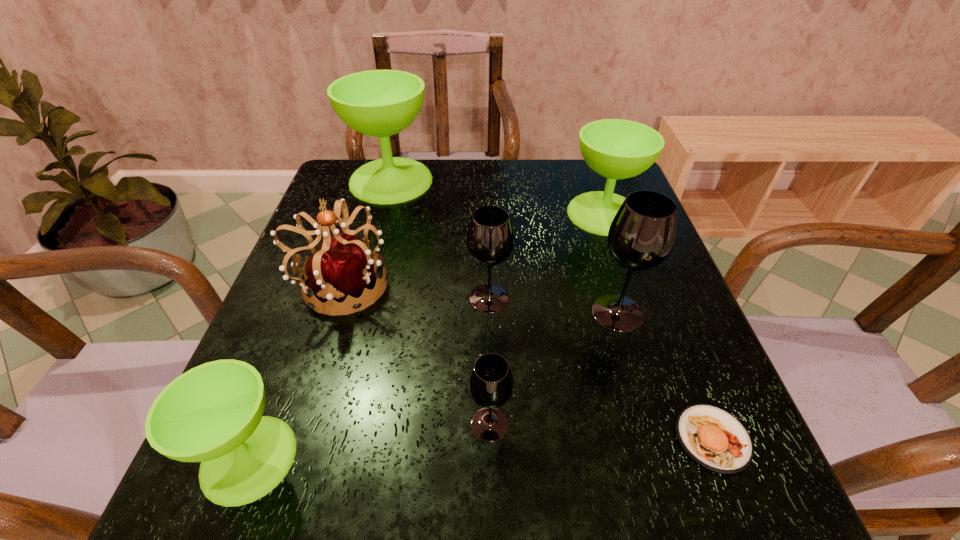
Image resolution: width=960 pixels, height=540 pixels. I want to click on free spot between the nearest green wineglass and the red tiara, so click(x=295, y=372).

Where is `free area in between the nearest green wineglass and the rightmost green wineglass`? free area in between the nearest green wineglass and the rightmost green wineglass is located at coordinates (426, 336).

Locate an element on the screen. The image size is (960, 540). free space between the biggest green wineglass and the rightmost green wineglass is located at coordinates (497, 197).

Image resolution: width=960 pixels, height=540 pixels. I want to click on vacant space in between the second smallest gray wineglass and the biggest gray wineglass, so click(x=553, y=305).

Find the location of a particular element. free spot between the rightmost green wineglass and the smallest green wineglass is located at coordinates [426, 336].

You are a GUI agent. You are given a task and a screenshot of the screen. Output one action in this format:
    pyautogui.click(x=<x>, y=<y>)
    Task: Click on the free space between the second biggest gray wineglass and the rightmost gray wineglass
    The height and width of the screenshot is (540, 960).
    Given the screenshot: What is the action you would take?
    pyautogui.click(x=553, y=305)

Identify which object is located as the third nearest to the biggest green wineglass. Please provide its 2D coordinates. Your answer should be formatted as a tuple, i.e. [(x, y)], where the tuple contains the x and y coordinates of a point satisfying the conditions above.

[(617, 149)]

What are the coordinates of `object that is the closest to the rightmost green wineglass` in the screenshot? It's located at (641, 236).

In order to click on the fourth closest wineglass to the smallest green wineglass in this screenshot , I will do `click(380, 103)`.

The height and width of the screenshot is (540, 960). Identify the location of wineglass that is the third nearest to the biggest green wineglass. tap(641, 236).